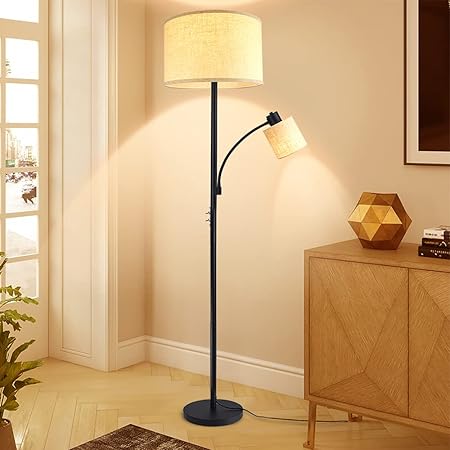
I want to click on wall, so click(164, 264), click(133, 274).